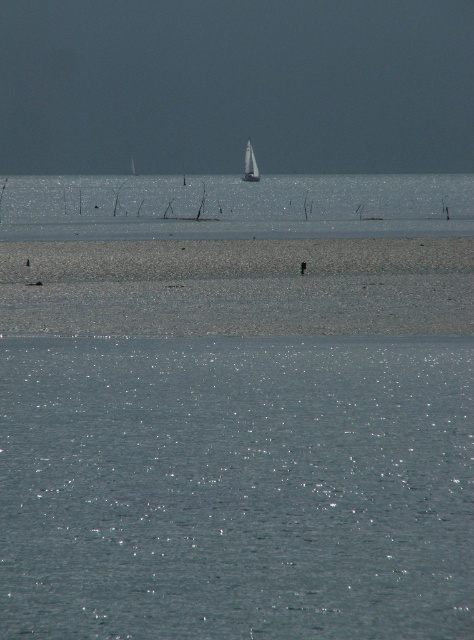
Question: Which point appears closest to the camera in this image?

Choices:
 (A) (257, 173)
 (B) (18, 500)

Answer: (B)

Question: Is sparkling silver water at center to the left of white glossy sailboat at upper center from the viewer's perspective?

Choices:
 (A) no
 (B) yes

Answer: (A)

Question: Is sparkling silver water at center smaller than white glossy sailboat at upper center?

Choices:
 (A) yes
 (B) no

Answer: (A)

Question: Does sparkling silver water at center have a smaller size compared to white glossy sailboat at upper center?

Choices:
 (A) yes
 (B) no

Answer: (A)